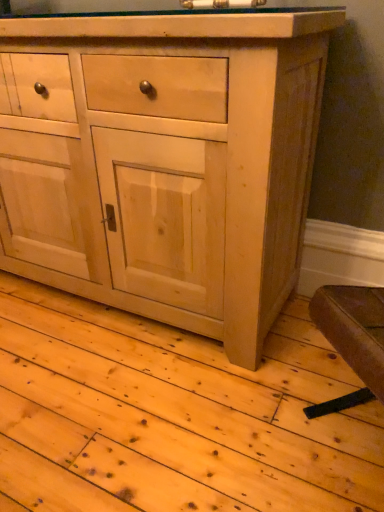
The width and height of the screenshot is (384, 512). What do you see at coordinates (163, 161) in the screenshot? I see `natural wood cabinet at center` at bounding box center [163, 161].

This screenshot has width=384, height=512. In order to click on natural wood cabinet at center in this screenshot , I will do `click(163, 161)`.

Locate an element on the screen. natural wood cabinet at center is located at coordinates (163, 161).